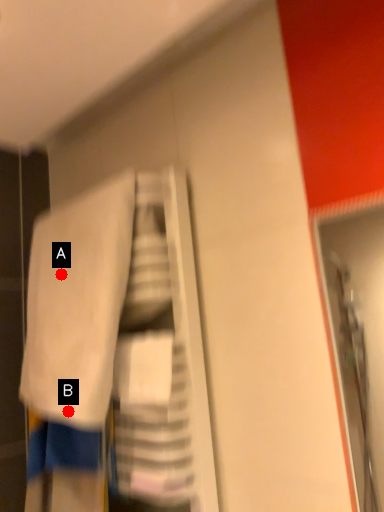
Question: Two points are circled on the image, labeled by A and B beside each circle. Which point is farther from the camera taking this photo?

Choices:
 (A) A is further
 (B) B is further

Answer: (A)